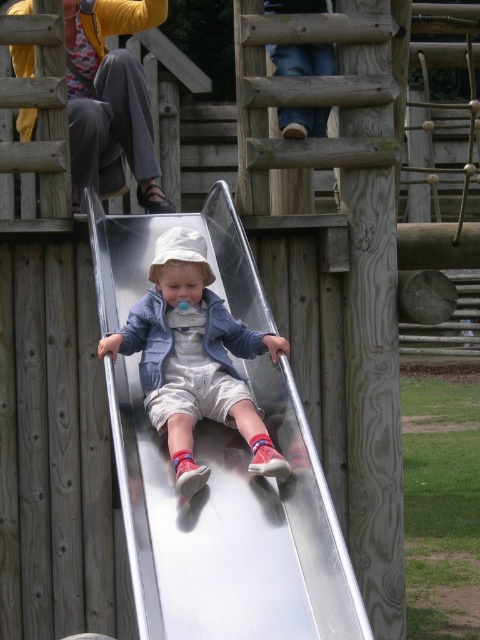
You are a parent at the playground. You see the silver metallic slide at center and the metallic silver slide at center. Which one is higher?

Both the silver metallic slide at center and the metallic silver slide at center are the same slide, so they are at the same height.

You are a parent watching your child play at the playground. You see the silver metallic slide at center and the metallic silver slide at center. Which one is closer to you?

Both the silver metallic slide at center and the metallic silver slide at center are the same object, so they are equally close to you.